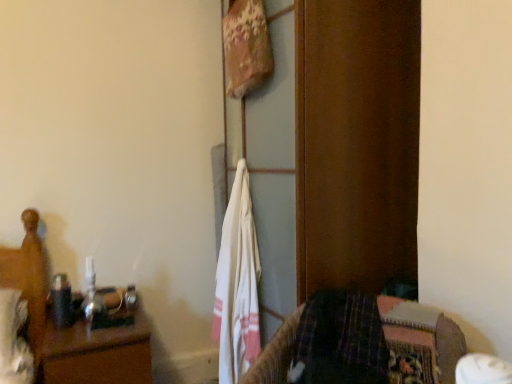
I want to click on white cotton towel at center, so click(237, 285).

The image size is (512, 384). What do you see at coordinates (28, 280) in the screenshot? I see `wooden bed at left` at bounding box center [28, 280].

What do you see at coordinates (423, 336) in the screenshot? I see `plaid fabric bedspread at lower right` at bounding box center [423, 336].

The image size is (512, 384). In order to click on wooden nightstand at left in this screenshot , I will do `click(98, 354)`.

Locate an element on the screen. white cotton towel at center is located at coordinates (237, 285).

Considering the sizes of objects wooden nightstand at left and white cotton towel at center in the image provided, who is wider, wooden nightstand at left or white cotton towel at center?

Wider between the two is wooden nightstand at left.

Is wooden nightstand at left to the left of white cotton towel at center from the viewer's perspective?

Yes.

Are wooden nightstand at left and white cotton towel at center making contact?

No.

Who is smaller, wooden nightstand at left or white cotton towel at center?

white cotton towel at center.

Is wooden nightstand at left not inside wooden bed at left?

That's correct, wooden nightstand at left is outside of wooden bed at left.

Is wooden nightstand at left facing away from wooden bed at left?

wooden nightstand at left is not turned away from wooden bed at left.

Identify the location of bed that is in front of the wooden nightstand at left. (28, 280).

Does wooden nightstand at left have a smaller size compared to wooden bed at left?

No.

In the scene shown: From a real-world perspective, is white cotton towel at center positioned over plaid fabric bedspread at lower right based on gravity?

Yes, from a real-world perspective, white cotton towel at center is over plaid fabric bedspread at lower right

Which object is positioned more to the right, white cotton towel at center or plaid fabric bedspread at lower right?

Positioned to the right is plaid fabric bedspread at lower right.

Is white cotton towel at center oriented away from plaid fabric bedspread at lower right?

No, white cotton towel at center is not facing away from plaid fabric bedspread at lower right.

How distant is white cotton towel at center from plaid fabric bedspread at lower right?

white cotton towel at center and plaid fabric bedspread at lower right are 25.44 inches apart from each other.

From the picture: Is white cotton towel at center wider or thinner than wooden bed at left?

Clearly, white cotton towel at center has less width compared to wooden bed at left.

Is white cotton towel at center positioned far away from wooden bed at left?

white cotton towel at center is actually quite close to wooden bed at left.

Is white cotton towel at center to the left or to the right of wooden bed at left in the image?

Result: In the image, white cotton towel at center appears on the right side of wooden bed at left.

From the image's perspective, does white cotton towel at center appear higher than wooden bed at left?

Yes, from the image's perspective, white cotton towel at center is over wooden bed at left.

Based on their sizes in the image, would you say white cotton towel at center is bigger or smaller than wooden nightstand at left?

Clearly, white cotton towel at center is smaller in size than wooden nightstand at left.

In the scene shown: Does white cotton towel at center have a greater height compared to wooden nightstand at left?

Correct, white cotton towel at center is much taller as wooden nightstand at left.

Which is closer, (x=222, y=252) or (x=122, y=342)?

Positioned in front is point (x=122, y=342).

Image resolution: width=512 pixels, height=384 pixels. What are the coordinates of `laundry that appears above the wooden nightstand at left (from the image's perspective)` in the screenshot? It's located at (237, 285).

Are wooden nightstand at left and plaid fabric bedspread at lower right making contact?

wooden nightstand at left and plaid fabric bedspread at lower right are clearly separated.

Identify the location of furniture located above the wooden nightstand at left (from a real-world perspective). (423, 336).

Considering the sizes of objects wooden nightstand at left and plaid fabric bedspread at lower right in the image provided, who is bigger, wooden nightstand at left or plaid fabric bedspread at lower right?

plaid fabric bedspread at lower right is bigger.

Looking at this image, from the image's perspective, which one is positioned higher, wooden nightstand at left or plaid fabric bedspread at lower right?

plaid fabric bedspread at lower right is shown above in the image.

Consider the image. From a real-world perspective, is wooden bed at left above or below plaid fabric bedspread at lower right?

wooden bed at left is situated lower than plaid fabric bedspread at lower right in the real world.

Are wooden bed at left and plaid fabric bedspread at lower right making contact?

No, wooden bed at left is not making contact with plaid fabric bedspread at lower right.

The width and height of the screenshot is (512, 384). Find the location of `bed on the left side of plaid fabric bedspread at lower right`. bed on the left side of plaid fabric bedspread at lower right is located at coordinates (28, 280).

Is wooden bed at left taller than plaid fabric bedspread at lower right?

Yes, wooden bed at left is taller than plaid fabric bedspread at lower right.

Identify the location of laundry located on the right of wooden nightstand at left. Image resolution: width=512 pixels, height=384 pixels. (237, 285).

The image size is (512, 384). Find the location of `nightstand below the wooden bed at left (from a real-world perspective)`. nightstand below the wooden bed at left (from a real-world perspective) is located at coordinates (98, 354).

Considering their positions, is plaid fabric bedspread at lower right positioned further to wooden bed at left than white cotton towel at center?

Based on the image, plaid fabric bedspread at lower right appears to be further to wooden bed at left.

Which object lies nearer to the anchor point wooden bed at left, wooden nightstand at left or plaid fabric bedspread at lower right?

Among the two, wooden nightstand at left is located nearer to wooden bed at left.

Based on their spatial positions, is white cotton towel at center or plaid fabric bedspread at lower right further from wooden bed at left?

The object further to wooden bed at left is plaid fabric bedspread at lower right.

Considering their positions, is wooden bed at left positioned further to plaid fabric bedspread at lower right than wooden nightstand at left?

Among the two, wooden bed at left is located further to plaid fabric bedspread at lower right.

Estimate the real-world distances between objects in this image. Which object is further from plaid fabric bedspread at lower right, wooden nightstand at left or white cotton towel at center?

The object further to plaid fabric bedspread at lower right is wooden nightstand at left.

When comparing their distances from plaid fabric bedspread at lower right, does wooden bed at left or white cotton towel at center seem further?

wooden bed at left is further to plaid fabric bedspread at lower right.

Which object lies further to the anchor point white cotton towel at center, plaid fabric bedspread at lower right or wooden nightstand at left?

plaid fabric bedspread at lower right is further to white cotton towel at center.

Considering their positions, is wooden bed at left positioned further to white cotton towel at center than wooden nightstand at left?

wooden bed at left.

Locate an element on the screen. The height and width of the screenshot is (384, 512). nightstand located between wooden bed at left and white cotton towel at center in the left-right direction is located at coordinates (98, 354).

In order to click on laundry located between wooden bed at left and plaid fabric bedspread at lower right in the left-right direction in this screenshot , I will do `click(237, 285)`.

I want to click on nightstand between wooden bed at left and plaid fabric bedspread at lower right in the horizontal direction, so click(x=98, y=354).

I want to click on laundry situated between wooden nightstand at left and plaid fabric bedspread at lower right from left to right, so click(x=237, y=285).